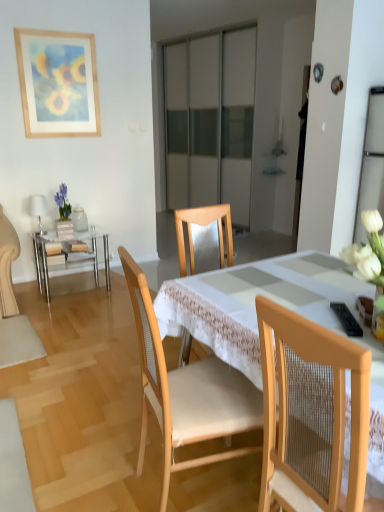
The image size is (384, 512). What are the coordinates of `free spot in front of clear glass table at left` in the screenshot? It's located at (76, 308).